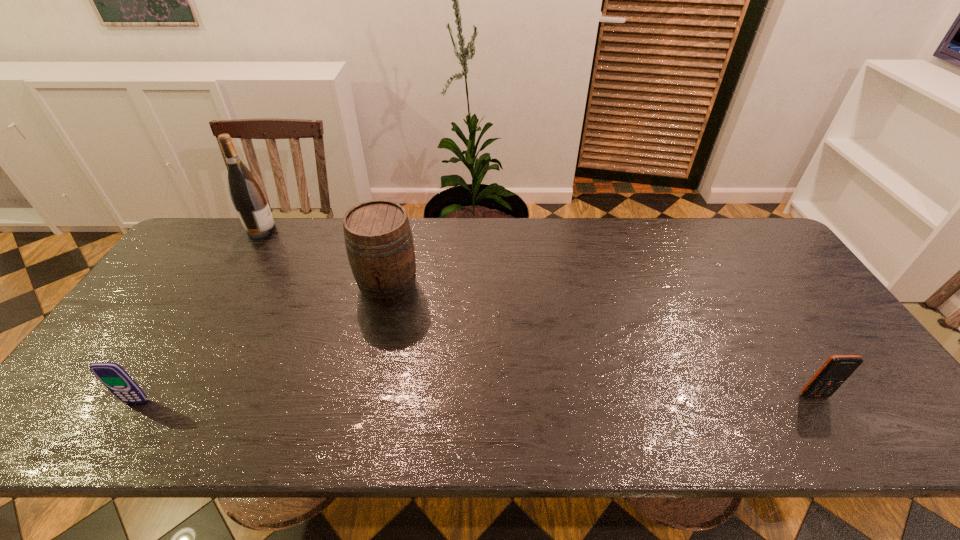
Identify the location of the farthest object. The height and width of the screenshot is (540, 960). (249, 200).

Find the location of a particular element. Image resolution: width=960 pixels, height=540 pixels. the tallest object is located at coordinates (249, 200).

I want to click on the second farthest object, so click(x=379, y=242).

This screenshot has width=960, height=540. Find the location of `the third shortest object`. the third shortest object is located at coordinates (379, 242).

Where is `the rightmost object`? The height and width of the screenshot is (540, 960). the rightmost object is located at coordinates (836, 370).

At what (x,y) coordinates should I click in order to perform the action: click on the right cellular telephone. Please return your answer as a coordinate pair (x, y). Looking at the image, I should click on (836, 370).

I want to click on the nearest object, so click(113, 376).

Find the location of a particular element. The image size is (960, 540). the nearer cellular telephone is located at coordinates (113, 376).

The width and height of the screenshot is (960, 540). Identify the location of free space located 0.400m on the label of the wine bottle. (395, 231).

The height and width of the screenshot is (540, 960). Find the location of `free region located on the side of the third nearest object near the bung hole`. free region located on the side of the third nearest object near the bung hole is located at coordinates (377, 334).